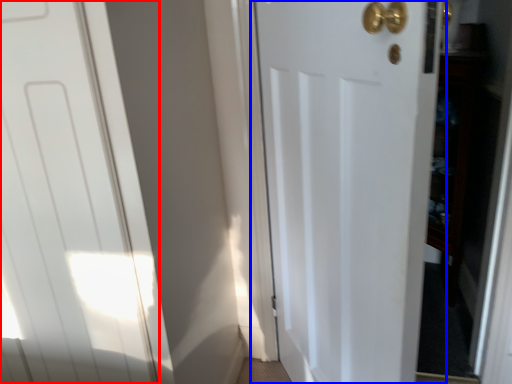
Question: Which point is further to the camera, door (highlighted by a red box) or door (highlighted by a blue box)?

Choices:
 (A) door
 (B) door

Answer: (A)